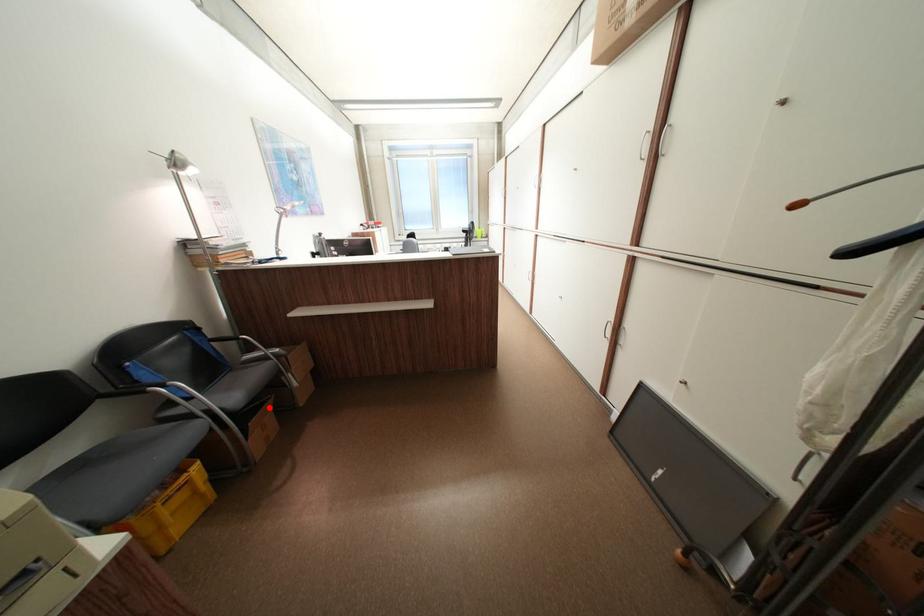
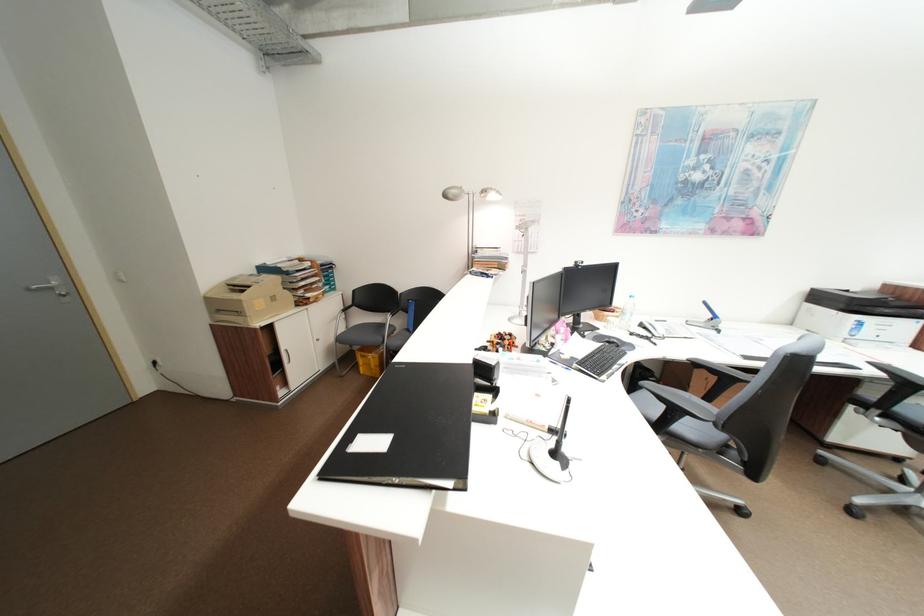
Question: I am providing you with two images of the same scene from different viewpoints. A red point is marked on the first image. At the location where the point appears in image 1, is it still visible in image 2?

Choices:
 (A) Yes
 (B) No

Answer: (B)